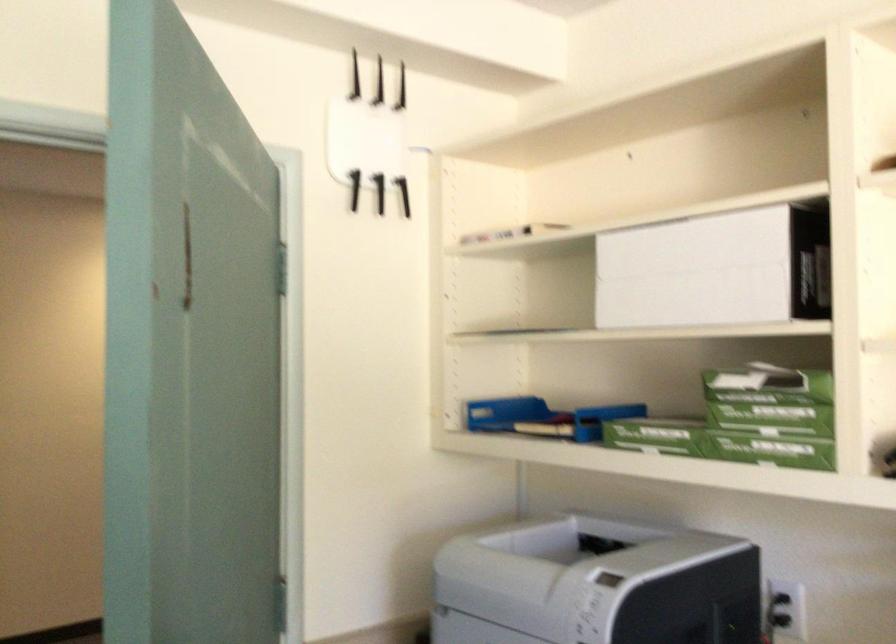
Identify the location of recessed door handle. (187, 254).